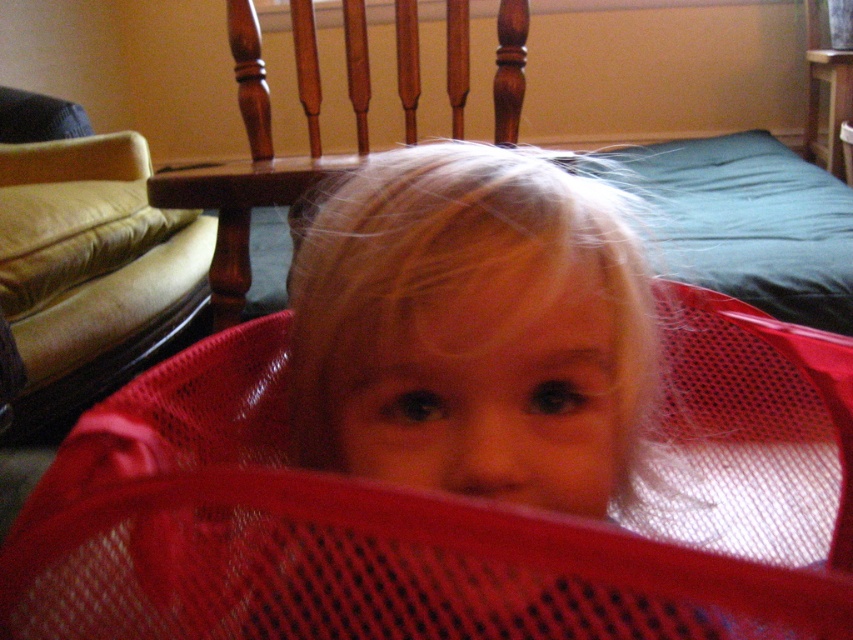
You are a parent trying to place a new toy box between the matte plastic basket at center and the wooden chair at center. The toy box requires 30 inches of space. Based on the scene, will there be enough space to fit the toy box between them?

The distance between the matte plastic basket at center and the wooden chair at center is 26.76 inches. Since the toy box requires 30 inches of space, there is not enough space to fit it between them.

You are a photographer trying to capture the exact spot where the child is peeking from the red plastic laundry basket. According to the image, where should you position your camera to ensure it aligns with the point at coordinates point (444, 512)?

The point (444, 512) is located on the red mesh basket at center, so you should position your camera directly facing the center of the basket to align with that point.

You are a parent trying to find a safe spot to place a small toy. You have two options in the image provided. The first is near the matte plastic basket at center, and the second is near the beige fabric couch at left. Considering their positions, which location is closer to you and thus safer for placing the toy?

The matte plastic basket at center is closer to the viewer than the beige fabric couch at left, so placing the toy near the matte plastic basket at center would be safer as it is nearer to your current position.